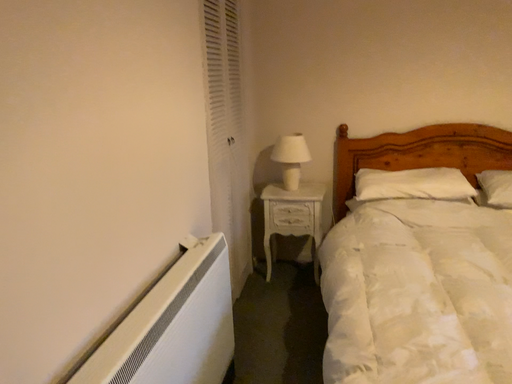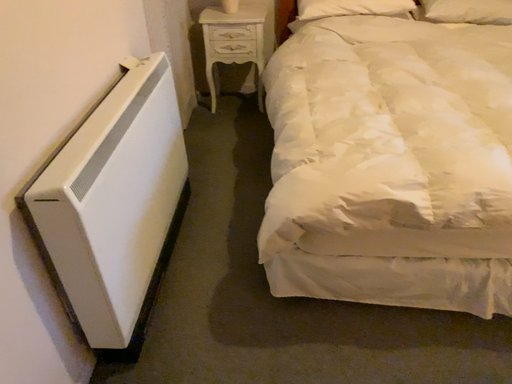
Question: How did the camera likely rotate when shooting the video?

Choices:
 (A) rotated left
 (B) rotated right

Answer: (B)